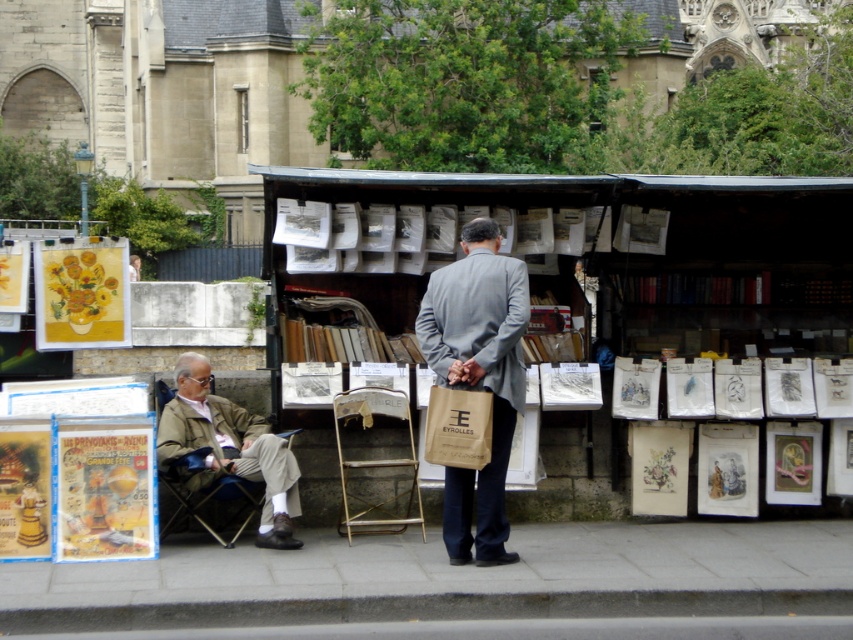
You are a delivery person carrying a large box that is 1 meter wide. You need to walk through the path between the gray concrete pavement at lower center and the khaki fabric jacket at left. Can you fit through the path?

The gray concrete pavement at lower center might be wider than khaki fabric jacket at left, so the path could be wide enough for the delivery person to fit through with their 1 meter wide box, but there is uncertainty as the exact width isn

You are standing in front of the book and poster stall and want to take a photo of both the point at coordinates point (844,602) and point (289,548). Which point should you focus on first to ensure both are in focus?

You should focus on point (844,602) first because it is closer to the camera than point (289,548), ensuring both points are within the depth of field.

You are a delivery person who needs to place a heavy box on the gray concrete pavement at lower center and the khaki fabric jacket at left. Which surface can support the weight better?

The gray concrete pavement at lower center is larger in size than the khaki fabric jacket at left, so it can support the weight better.